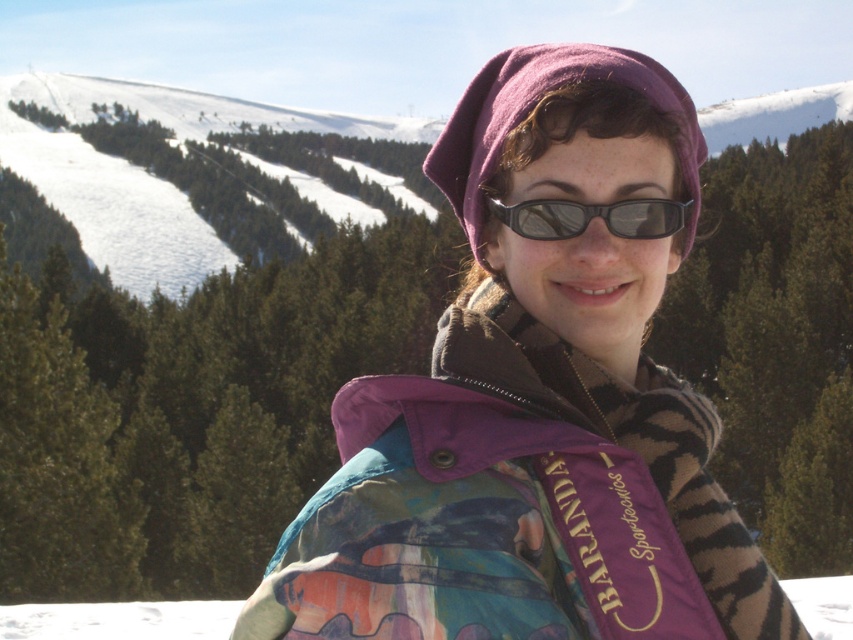
You are navigating through the snowy mountain area and see two points marked on your map. The first point is at coordinates point (547, 60) and the second is at point (584, 228). According to the image, which point is closer to you?

Point (584, 228) is closer to you because point (547, 60) is behind it.

You are a photographer trying to capture the purple fleece jacket at center in the image. The camera you are using has a focus point at coordinate point [534,403]. Will this focus point align with the jacket?

Yes, the purple fleece jacket at center is located at point [534,403], so the focus point will align with the jacket.

You are a photographer trying to capture the person in the snowy mountain scene. You want to ensure both the purple fleece jacket at center and the black matte sunglasses at center are clearly visible in your shot. Given their sizes, which object should you focus on to ensure it remains in frame even if you move slightly?

The purple fleece jacket at center is wider than the black matte sunglasses at center, so focusing on the purple fleece jacket at center will ensure it stays in frame even with slight movements, as it has a larger size.